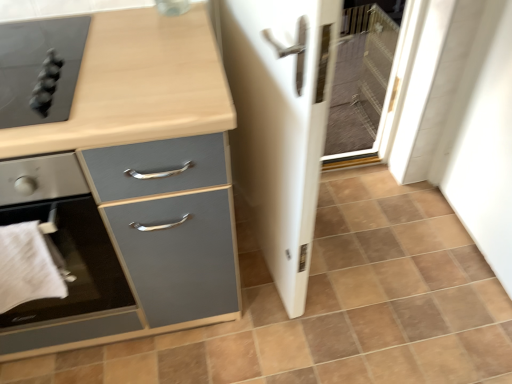
You are a GUI agent. You are given a task and a screenshot of the screen. Output one action in this format:
    pyautogui.click(x=<x>, y=<y>)
    Task: Click on the spots to the right of white glossy screen door at center
    
    Given the screenshot: What is the action you would take?
    pyautogui.click(x=376, y=251)